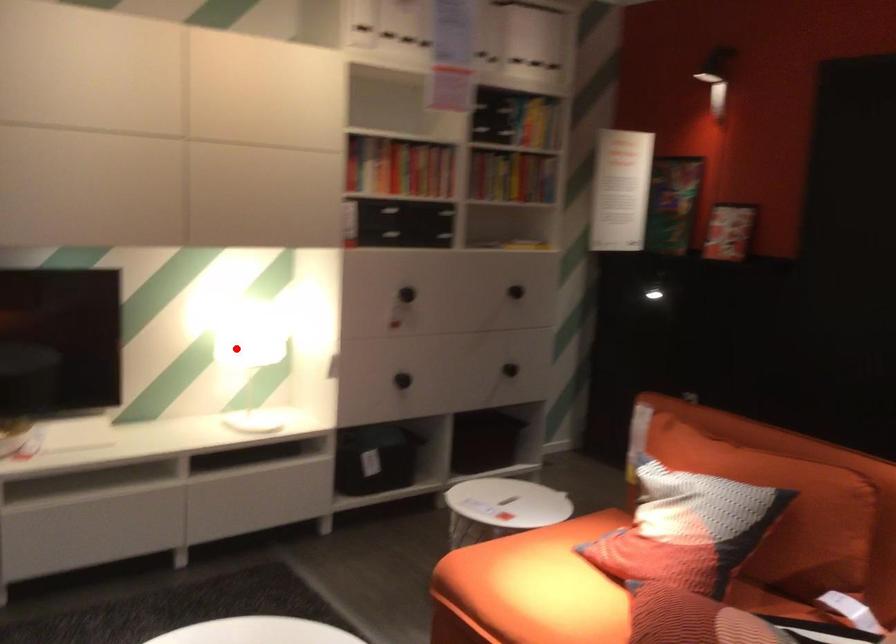
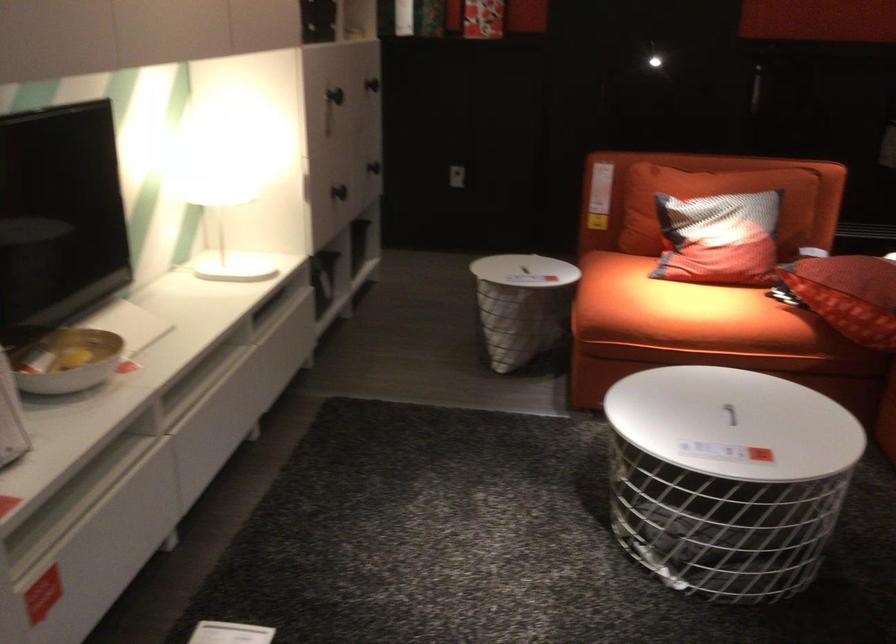
Question: I am providing you with two images of the same scene from different viewpoints. A red point is shown in image1. For the corresponding object point in image2, is it positioned nearer or farther from the camera?

Choices:
 (A) Nearer
 (B) Farther

Answer: (A)